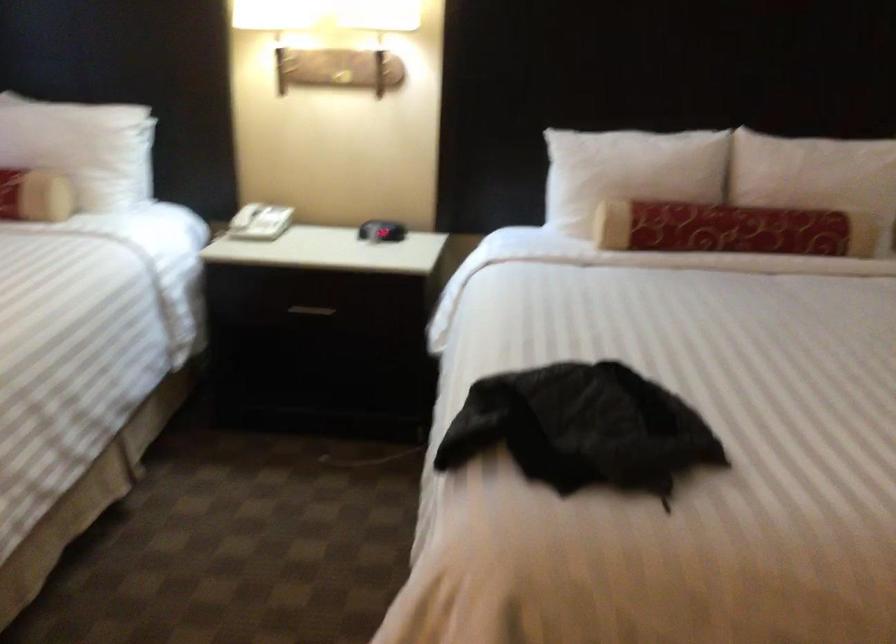
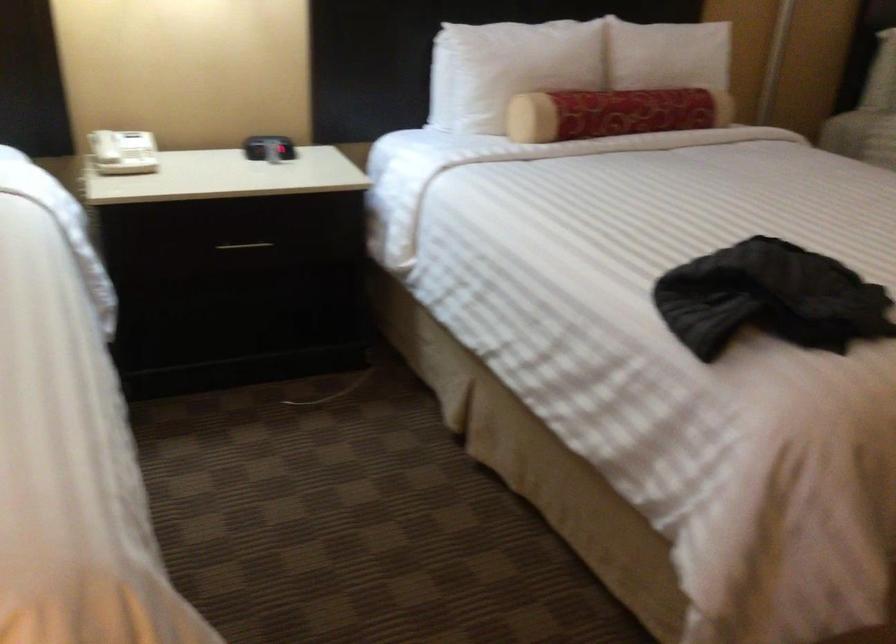
Question: What movement of the cameraman would produce the second image?

Choices:
 (A) Left
 (B) Right
 (C) Forward
 (D) Backward

Answer: (A)